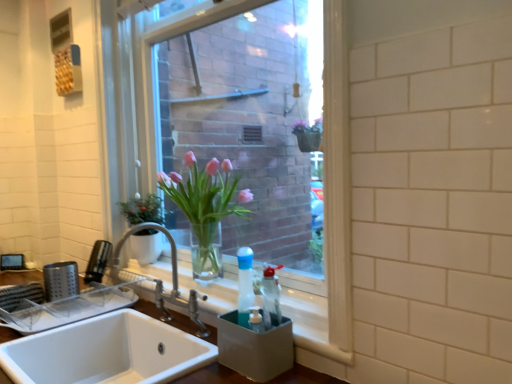
Question: Considering their positions, is satin nickel faucet at sink left located in front of or behind white ceramic sink at lower left, placed as the second sink when sorted from top to bottom?

Choices:
 (A) front
 (B) behind

Answer: (B)

Question: In the image, is satin nickel faucet at sink left on the left side or the right side of white ceramic sink at lower left, placed as the second sink when sorted from top to bottom?

Choices:
 (A) right
 (B) left

Answer: (A)

Question: Which object is positioned closest to the clear glass vase at center?

Choices:
 (A) satin nickel faucet at sink left
 (B) white ceramic sink at lower left, placed as the second sink when sorted from top to bottom
 (C) pink glass vase at center
 (D) white ceramic sink at lower left, the second sink when ordered from bottom to top

Answer: (C)

Question: Estimate the real-world distances between objects in this image. Which object is closer to the white ceramic sink at lower left, the second sink when ordered from bottom to top?

Choices:
 (A) clear glass vase at center
 (B) pink glass vase at center
 (C) satin nickel faucet at sink left
 (D) white ceramic sink at lower left, placed as the second sink when sorted from top to bottom

Answer: (D)